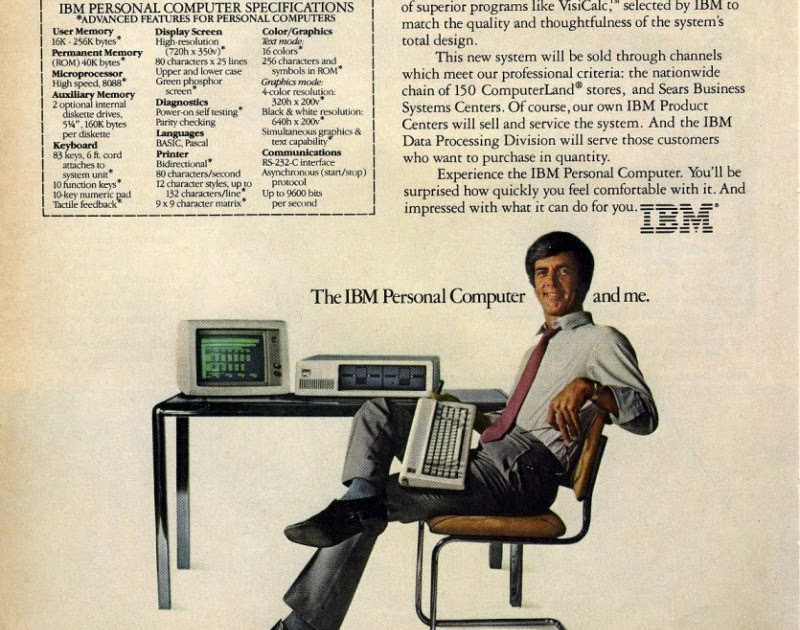
At what (x,y) coordinates should I click in order to perform the action: click on chair. Please return your answer as a coordinate pair (x, y). Looking at the image, I should click on (501, 529), (588, 469).